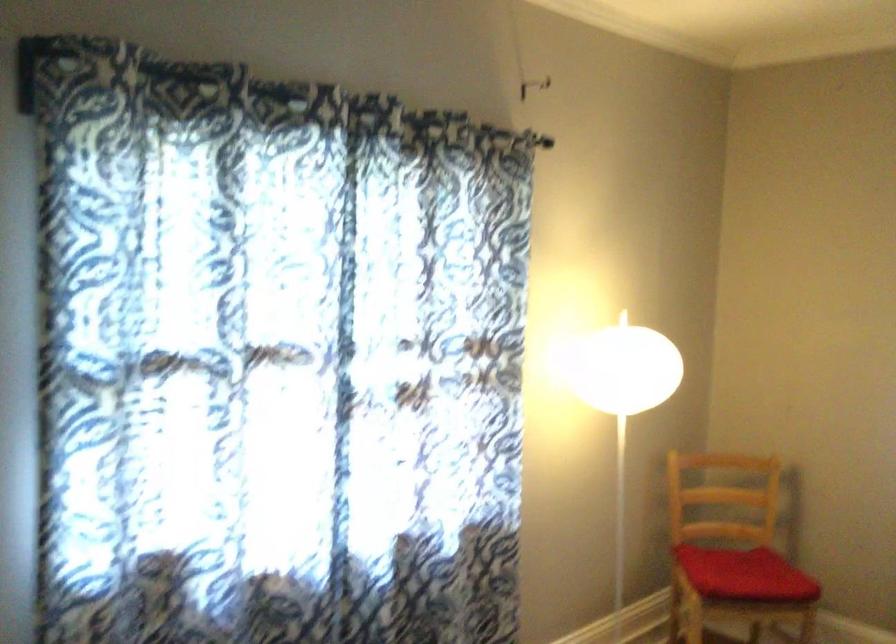
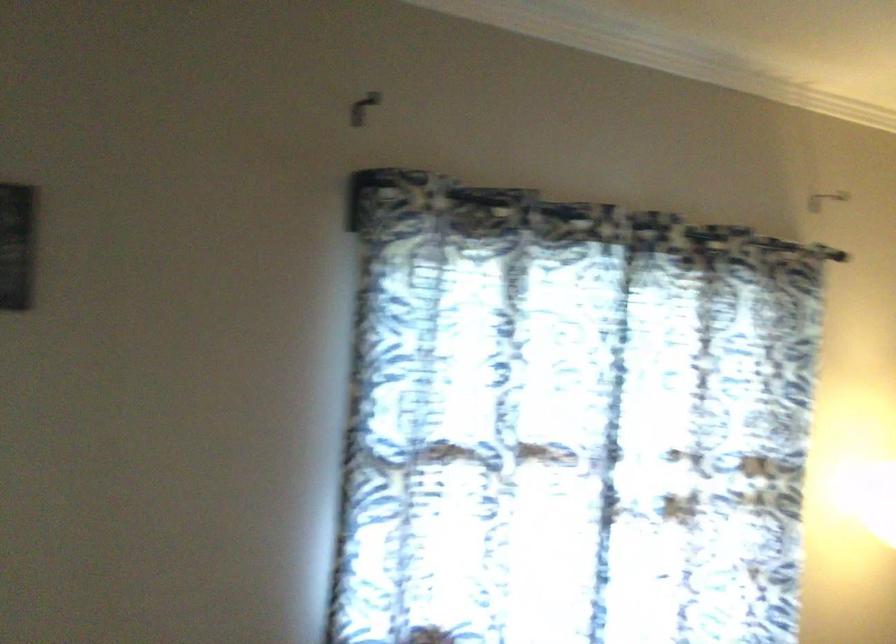
Question: Which direction would the cameraman need to move to produce the second image? Reply with the corresponding letter.

Choices:
 (A) Left
 (B) Right
 (C) Forward
 (D) Backward

Answer: (D)